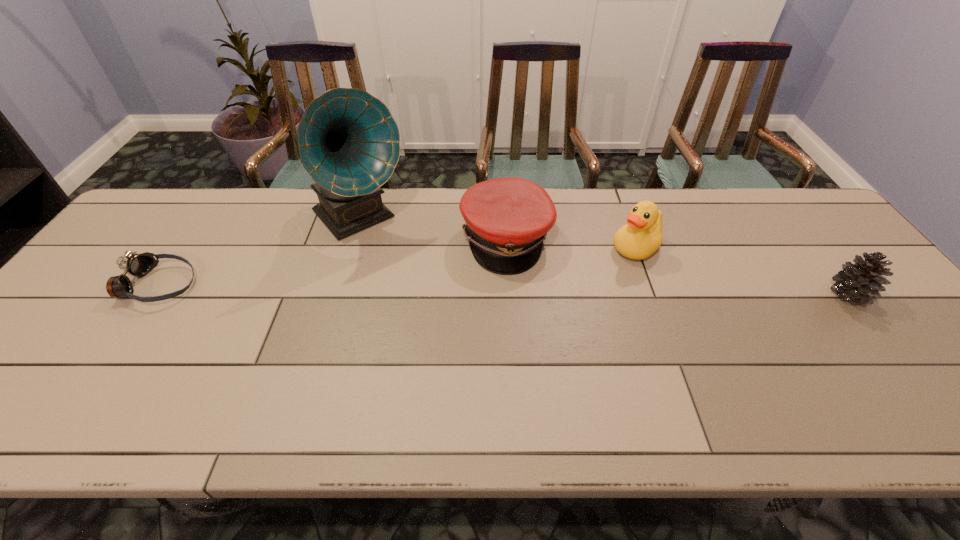
I want to click on phonograph_record that is at the far edge, so click(348, 142).

The height and width of the screenshot is (540, 960). In order to click on cap that is at the far edge in this screenshot , I will do `click(507, 219)`.

The image size is (960, 540). I want to click on object at the left edge, so click(x=133, y=264).

The width and height of the screenshot is (960, 540). I want to click on object situated at the right edge, so click(860, 283).

At what (x,y) coordinates should I click in order to perform the action: click on free space at the far edge of the desktop. Please return your answer as a coordinate pair (x, y). This screenshot has width=960, height=540. Looking at the image, I should click on (397, 205).

Find the location of a particular element. The height and width of the screenshot is (540, 960). vacant space at the near edge is located at coordinates (640, 382).

You are a GUI agent. You are given a task and a screenshot of the screen. Output one action in this format:
    pyautogui.click(x=<x>, y=<y>)
    Task: Click on the vacant space at the right edge of the desktop
    The width and height of the screenshot is (960, 540).
    Given the screenshot: What is the action you would take?
    pyautogui.click(x=888, y=300)

In the image, there is a desktop. Where is `vacant space at the far left corner`? The width and height of the screenshot is (960, 540). vacant space at the far left corner is located at coordinates (163, 230).

In the image, there is a desktop. Where is `vacant area at the near left corner`? vacant area at the near left corner is located at coordinates (53, 376).

Where is `free space at the far right corner`? free space at the far right corner is located at coordinates (814, 231).